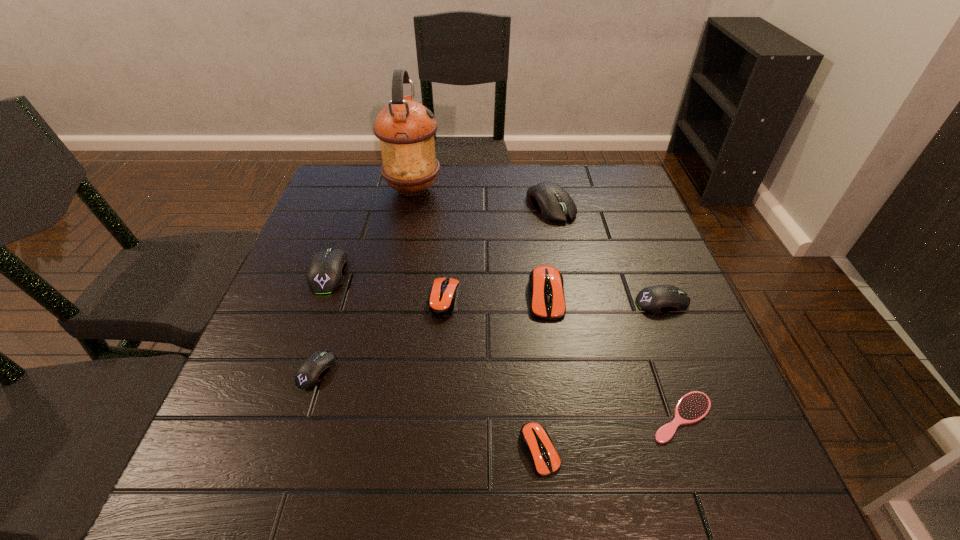
The width and height of the screenshot is (960, 540). Find the location of `blank area in the image that satisfies the following two spatial constraints: 1. on the front side of the shortest object; 2. on the right side of the tallest object`. blank area in the image that satisfies the following two spatial constraints: 1. on the front side of the shortest object; 2. on the right side of the tallest object is located at coordinates (368, 417).

Locate an element on the screen. Image resolution: width=960 pixels, height=540 pixels. free spot that satisfies the following two spatial constraints: 1. on the front side of the rightmost black computer equipment; 2. on the right side of the farthest computer mouse is located at coordinates (570, 302).

Identify the location of free point that satisfies the following two spatial constraints: 1. on the back side of the biggest orange computer mouse; 2. on the right side of the nearest black computer equipment. The height and width of the screenshot is (540, 960). (340, 295).

Identify the location of vacant space that satisfies the following two spatial constraints: 1. on the front side of the biggest orange computer mouse; 2. on the left side of the shortest object. The image size is (960, 540). (564, 417).

The width and height of the screenshot is (960, 540). In order to click on free space in the image that satisfies the following two spatial constraints: 1. on the back side of the seventh farthest object; 2. on the right side of the oil lamp in this screenshot , I will do `click(373, 189)`.

I want to click on vacant point that satisfies the following two spatial constraints: 1. on the back side of the second nearest computer mouse; 2. on the left side of the oil lamp, so click(373, 189).